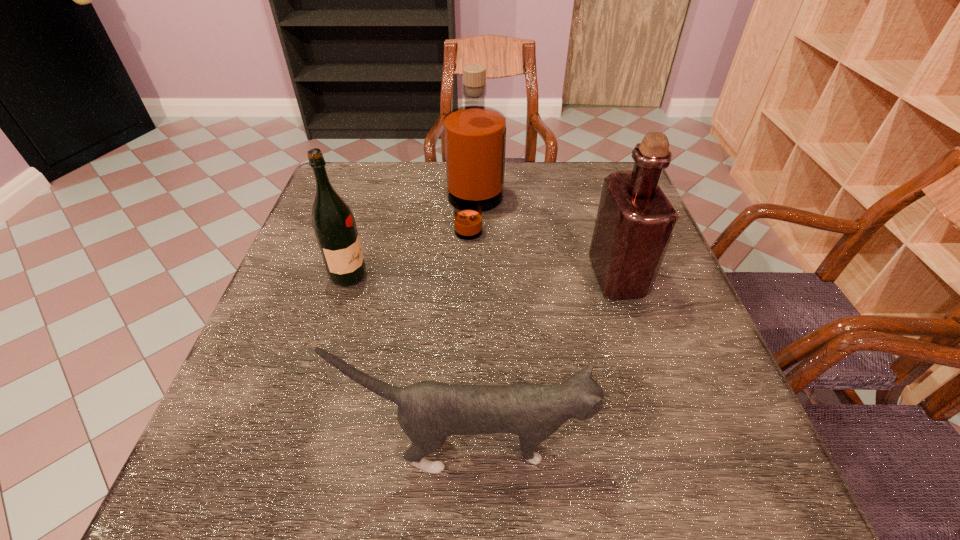
The height and width of the screenshot is (540, 960). I want to click on object that is at the far edge, so click(474, 135).

You are a GUI agent. You are given a task and a screenshot of the screen. Output one action in this format:
    pyautogui.click(x=<x>, y=<y>)
    Task: Click on the object present at the near edge
    
    Given the screenshot: What is the action you would take?
    pyautogui.click(x=428, y=412)

At what (x,y) coordinates should I click in order to perform the action: click on object located at the left edge. Please return your answer as a coordinate pair (x, y). This screenshot has width=960, height=540. Looking at the image, I should click on (334, 225).

Identify the location of object at the right edge. This screenshot has width=960, height=540. (635, 221).

Where is `vacant area at the far edge of the desktop`? The height and width of the screenshot is (540, 960). vacant area at the far edge of the desktop is located at coordinates (516, 170).

You are a GUI agent. You are given a task and a screenshot of the screen. Output one action in this format:
    pyautogui.click(x=<x>, y=<y>)
    Task: Click on the vacant space at the near edge of the desktop
    
    Given the screenshot: What is the action you would take?
    pos(461,484)

At what (x,y) coordinates should I click in order to perform the action: click on free region at the left edge of the desktop. Please return your answer as a coordinate pair (x, y). The height and width of the screenshot is (540, 960). Looking at the image, I should click on (263, 360).

Where is `free space at the right edge of the desktop`? The height and width of the screenshot is (540, 960). free space at the right edge of the desktop is located at coordinates (704, 363).

This screenshot has width=960, height=540. In the image, there is a desktop. What are the coordinates of `vacant region at the far left corner` in the screenshot? It's located at (358, 190).

The width and height of the screenshot is (960, 540). I want to click on vacant space at the near left corner of the desktop, so click(x=194, y=512).